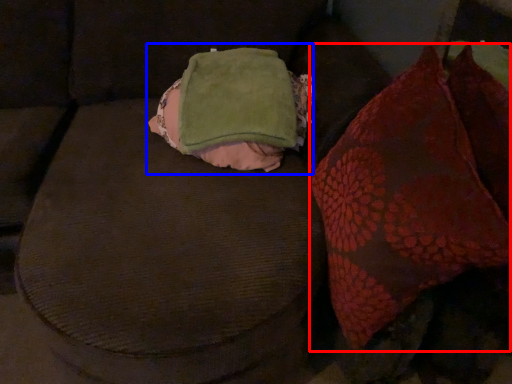
Question: Among these objects, which one is farthest to the camera, throw pillow (highlighted by a red box) or bean bag chair (highlighted by a blue box)?

Choices:
 (A) throw pillow
 (B) bean bag chair

Answer: (B)